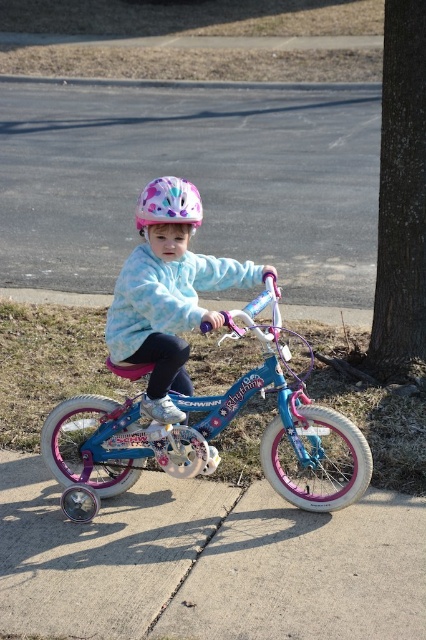
What is the exact location of the asphalt at center in the image?

The asphalt at center is located at point coordinates of 0.283 on the x axis and 0.451 on the y axis.

You are a delivery robot that needs to place a small package on the surface that is bigger than the helmet. Which surface should you choose between the asphalt at center and the pastel polka dot helmet at center?

The asphalt at center is bigger than the pastel polka dot helmet at center, so you should choose the asphalt at center to place the small package.